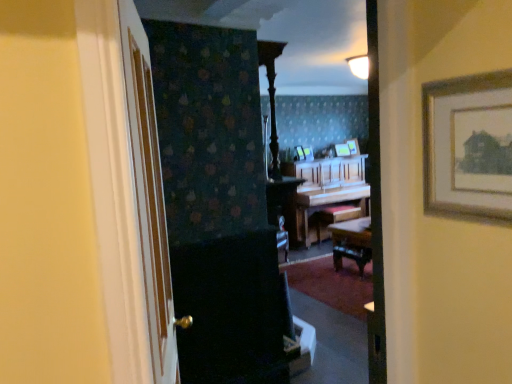
Question: Could you tell me if wooden picture frame at center, placed as the 1th picture frame when sorted from right to left, is facing white wood door at left?

Choices:
 (A) yes
 (B) no

Answer: (B)

Question: Is wooden picture frame at center, placed as the 1th picture frame when sorted from right to left, touching white wood door at left?

Choices:
 (A) no
 (B) yes

Answer: (A)

Question: From the image's perspective, is wooden picture frame at center, which is the fourth picture frame in left-to-right order, located beneath white wood door at left?

Choices:
 (A) yes
 (B) no

Answer: (B)

Question: Does wooden picture frame at center, which is the fourth picture frame in left-to-right order, have a smaller size compared to white wood door at left?

Choices:
 (A) no
 (B) yes

Answer: (B)

Question: Is wooden picture frame at center, which is the fourth picture frame in left-to-right order, in front of white wood door at left?

Choices:
 (A) yes
 (B) no

Answer: (B)

Question: Looking at the image, does white wood door at left seem bigger or smaller compared to wooden piano at center?

Choices:
 (A) small
 (B) big

Answer: (A)

Question: Does point (123, 72) appear closer or farther from the camera than point (337, 198)?

Choices:
 (A) farther
 (B) closer

Answer: (B)

Question: Considering their positions, is white wood door at left located in front of or behind wooden piano at center?

Choices:
 (A) behind
 (B) front

Answer: (B)

Question: Considering the positions of white wood door at left and wooden piano at center in the image, is white wood door at left taller or shorter than wooden piano at center?

Choices:
 (A) short
 (B) tall

Answer: (B)

Question: Is wooden picture frame at center, which is the fourth picture frame in left-to-right order, inside or outside of wooden piano at center?

Choices:
 (A) outside
 (B) inside

Answer: (A)

Question: Is wooden picture frame at center, which is the fourth picture frame in left-to-right order, to the left or to the right of wooden piano at center in the image?

Choices:
 (A) left
 (B) right

Answer: (B)

Question: In the image, is wooden picture frame at center, which is the fourth picture frame in left-to-right order, positioned in front of or behind wooden piano at center?

Choices:
 (A) behind
 (B) front

Answer: (A)

Question: Considering the positions of wooden picture frame at center, which is the fourth picture frame in left-to-right order, and wooden piano at center in the image, is wooden picture frame at center, which is the fourth picture frame in left-to-right order, wider or thinner than wooden piano at center?

Choices:
 (A) thin
 (B) wide

Answer: (A)

Question: From the image's perspective, is wooden picture frame at center, placed as the 1th picture frame when sorted from right to left, located above or below wooden picture frame at center, marked as the third picture frame in a left-to-right arrangement?

Choices:
 (A) below
 (B) above

Answer: (B)

Question: Based on their positions, is wooden picture frame at center, which is the fourth picture frame in left-to-right order, located to the left or right of wooden picture frame at center, which is the 2th picture frame from right to left?

Choices:
 (A) left
 (B) right

Answer: (B)